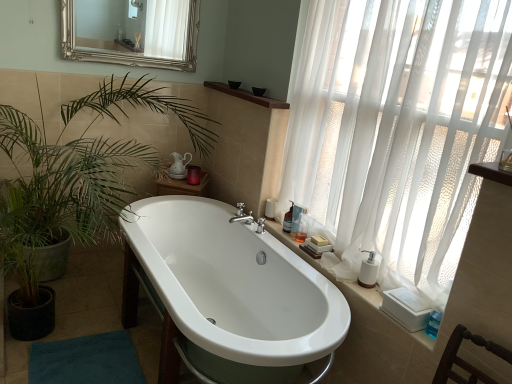
The width and height of the screenshot is (512, 384). What do you see at coordinates (397, 128) in the screenshot? I see `white sheer curtain at right` at bounding box center [397, 128].

The image size is (512, 384). What do you see at coordinates (247, 95) in the screenshot?
I see `brown wood shelf at upper center` at bounding box center [247, 95].

Where is `teal fabric bath mat at lower left`? teal fabric bath mat at lower left is located at coordinates (86, 360).

From the white glossy bathtub at center, count 1st toiletry to the right and point to it. Please provide its 2D coordinates.

[(288, 219)]

From a real-world perspective, relative to white glossy bathtub at center, is translucent plastic bottle at right, which appears as the 3th toiletry when viewed from the front, vertically above or below?

Clearly, from a real-world perspective, translucent plastic bottle at right, which appears as the 3th toiletry when viewed from the front, is above white glossy bathtub at center.

Which of these two, translucent plastic bottle at right, which ranks as the first toiletry in back-to-front order, or white glossy bathtub at center, is wider?

→ white glossy bathtub at center is wider.

In the scene shown: Between translucent plastic bottle at right, which ranks as the first toiletry in back-to-front order, and white glossy bathtub at center, which one appears on the left side from the viewer's perspective?

Positioned to the left is white glossy bathtub at center.

Locate an element on the screen. The height and width of the screenshot is (384, 512). balustrade on the right of white glossy bathtub at center is located at coordinates click(247, 95).

Are white glossy bathtub at center and brown wood shelf at upper center far apart?

Absolutely, white glossy bathtub at center is distant from brown wood shelf at upper center.

From a real-world perspective, which is physically below, white glossy bathtub at center or brown wood shelf at upper center?

white glossy bathtub at center.

From the image's perspective, which is above, white glossy bathtub at center or brown wood shelf at upper center?

brown wood shelf at upper center is shown above in the image.

Are white glossy bathtub at center and green leafy plant at left located far from each other?

No, white glossy bathtub at center is not far from green leafy plant at left.

Is white glossy bathtub at center shorter than green leafy plant at left?

Indeed, white glossy bathtub at center has a lesser height compared to green leafy plant at left.

Is green leafy plant at left at the back of white glossy bathtub at center?

No, green leafy plant at left is not at the back of white glossy bathtub at center.

Is brown wood shelf at upper center turned away from translucent plastic bottle at right, arranged as the third toiletry when viewed from the back?

No, brown wood shelf at upper center is not facing away from translucent plastic bottle at right, arranged as the third toiletry when viewed from the back.

Would you say brown wood shelf at upper center is to the left or to the right of translucent plastic bottle at right, which is the first toiletry from front to back, in the picture?

Clearly, brown wood shelf at upper center is on the left of translucent plastic bottle at right, which is the first toiletry from front to back, in the image.

Considering the sizes of brown wood shelf at upper center and translucent plastic bottle at right, which is the first toiletry from front to back, in the image, is brown wood shelf at upper center taller or shorter than translucent plastic bottle at right, which is the first toiletry from front to back,?

In the image, brown wood shelf at upper center appears to be shorter than translucent plastic bottle at right, which is the first toiletry from front to back.

Is translucent plastic bottle at right, which appears as the 3th toiletry when viewed from the front, positioned beyond the bounds of white sheer curtain at right?

That's incorrect, translucent plastic bottle at right, which appears as the 3th toiletry when viewed from the front, is not completely outside white sheer curtain at right.

Based on the photo, are translucent plastic bottle at right, which ranks as the first toiletry in back-to-front order, and white sheer curtain at right making contact?

No, translucent plastic bottle at right, which ranks as the first toiletry in back-to-front order, is not touching white sheer curtain at right.

From a real-world perspective, who is located lower, translucent plastic bottle at right, which appears as the 3th toiletry when viewed from the front, or white sheer curtain at right?

From a 3D spatial view, translucent plastic bottle at right, which appears as the 3th toiletry when viewed from the front, is below.

Can you confirm if translucent plastic bottle at right, which ranks as the first toiletry in back-to-front order, is positioned to the left of white sheer curtain at right?

Indeed, translucent plastic bottle at right, which ranks as the first toiletry in back-to-front order, is positioned on the left side of white sheer curtain at right.

From a real-world perspective, is clear plastic soap dispenser at right, the 2th toiletry viewed from the front, beneath silver/gilded mirror at upper center?

Indeed, from a real-world perspective, clear plastic soap dispenser at right, the 2th toiletry viewed from the front, is positioned beneath silver/gilded mirror at upper center.

From the image's perspective, would you say clear plastic soap dispenser at right, the 2th toiletry viewed from the front, is positioned over silver/gilded mirror at upper center?

No, from the image's perspective, clear plastic soap dispenser at right, the 2th toiletry viewed from the front, is not on top of silver/gilded mirror at upper center.

Who is taller, clear plastic soap dispenser at right, placed as the 2th toiletry when sorted from back to front, or silver/gilded mirror at upper center?

silver/gilded mirror at upper center.

Between clear plastic soap dispenser at right, placed as the 2th toiletry when sorted from back to front, and teal fabric bath mat at lower left, which one is positioned in front?

teal fabric bath mat at lower left is in front.

From the image's perspective, is clear plastic soap dispenser at right, placed as the 2th toiletry when sorted from back to front, positioned above or below teal fabric bath mat at lower left?

clear plastic soap dispenser at right, placed as the 2th toiletry when sorted from back to front, is above teal fabric bath mat at lower left.

Are clear plastic soap dispenser at right, placed as the 2th toiletry when sorted from back to front, and teal fabric bath mat at lower left beside each other?

No, clear plastic soap dispenser at right, placed as the 2th toiletry when sorted from back to front, is not making contact with teal fabric bath mat at lower left.

What's the angular difference between clear plastic soap dispenser at right, placed as the 2th toiletry when sorted from back to front, and teal fabric bath mat at lower left's facing directions?

The facing directions of clear plastic soap dispenser at right, placed as the 2th toiletry when sorted from back to front, and teal fabric bath mat at lower left are 13 degrees apart.

Which toiletry is the 3rd one when counting from the back of the white glossy bathtub at center? Please provide its 2D coordinates.

[(288, 219)]

The image size is (512, 384). Find the location of `balustrade that appears on the right of white glossy bathtub at center`. balustrade that appears on the right of white glossy bathtub at center is located at coordinates (247, 95).

When comparing their distances from green leafy plant at left, does brown wood shelf at upper center or translucent plastic bottle at right, arranged as the third toiletry when viewed from the back, seem further?

Based on the image, translucent plastic bottle at right, arranged as the third toiletry when viewed from the back, appears to be further to green leafy plant at left.

Looking at the image, which one is located further to translucent plastic bottle at right, arranged as the third toiletry when viewed from the back, brown wood shelf at upper center or teal fabric bath mat at lower left?

teal fabric bath mat at lower left.

Considering their positions, is brown wood shelf at upper center positioned closer to translucent plastic bottle at right, arranged as the third toiletry when viewed from the back, than white sheer curtain at right?

white sheer curtain at right is closer to translucent plastic bottle at right, arranged as the third toiletry when viewed from the back.

Considering their positions, is brown wood shelf at upper center positioned further to translucent plastic bottle at right, which appears as the 3th toiletry when viewed from the front, than white sheer curtain at right?

white sheer curtain at right.

From the image, which object appears to be farther from teal fabric bath mat at lower left, silver/gilded mirror at upper center or translucent plastic bottle at right, which appears as the 3th toiletry when viewed from the front?

silver/gilded mirror at upper center is further to teal fabric bath mat at lower left.

Estimate the real-world distances between objects in this image. Which object is closer to silver/gilded mirror at upper center, white sheer curtain at right or translucent plastic bottle at right, which is the first toiletry from front to back?

The object closer to silver/gilded mirror at upper center is white sheer curtain at right.

Which object lies nearer to the anchor point brown wood shelf at upper center, silver/gilded mirror at upper center or white glossy bathtub at center?

white glossy bathtub at center is closer to brown wood shelf at upper center.

Estimate the real-world distances between objects in this image. Which object is further from clear plastic soap dispenser at right, the 2th toiletry viewed from the front, translucent plastic bottle at right, which ranks as the first toiletry in back-to-front order, or brown wood shelf at upper center?

The object further to clear plastic soap dispenser at right, the 2th toiletry viewed from the front, is brown wood shelf at upper center.

You are a GUI agent. You are given a task and a screenshot of the screen. Output one action in this format:
    pyautogui.click(x=<x>, y=<y>)
    Task: Click on the balustrade between silver/gilded mirror at upper center and white glossy bathtub at center from top to bottom
    The width and height of the screenshot is (512, 384).
    Given the screenshot: What is the action you would take?
    pyautogui.click(x=247, y=95)

Where is `toiletry between translucent plastic bottle at right, arranged as the third toiletry when viewed from the back, and translucent plastic bottle at right, which appears as the 3th toiletry when viewed from the front, from front to back`? toiletry between translucent plastic bottle at right, arranged as the third toiletry when viewed from the back, and translucent plastic bottle at right, which appears as the 3th toiletry when viewed from the front, from front to back is located at coordinates (296, 219).

Identify the location of houseplant between silver/gilded mirror at upper center and teal fabric bath mat at lower left in the vertical direction. Image resolution: width=512 pixels, height=384 pixels. (72, 187).

Identify the location of curtain between silver/gilded mirror at upper center and teal fabric bath mat at lower left from top to bottom. The height and width of the screenshot is (384, 512). (397, 128).